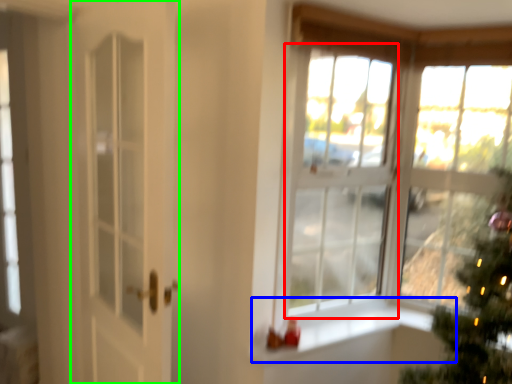
Question: Based on their relative distances, which object is nearer to window (highlighted by a red box)? Choose from window sill (highlighted by a blue box) and door (highlighted by a green box).

Choices:
 (A) window sill
 (B) door

Answer: (A)